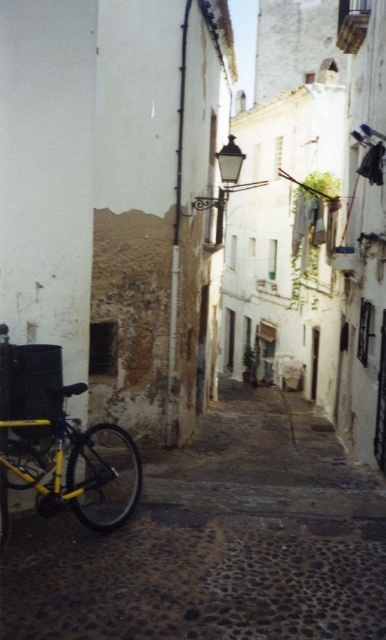
From the picture: Between yellow metallic bicycle at lower left and yellow matte bicycle at lower left, which one appears on the left side from the viewer's perspective?

From the viewer's perspective, yellow matte bicycle at lower left appears more on the left side.

Who is positioned more to the right, yellow metallic bicycle at lower left or yellow matte bicycle at lower left?

yellow metallic bicycle at lower left is more to the right.

Does point (291, 525) lie behind point (82, 452)?

Yes, it is.

Find the location of a particular element. The height and width of the screenshot is (640, 386). yellow metallic bicycle at lower left is located at coordinates (216, 541).